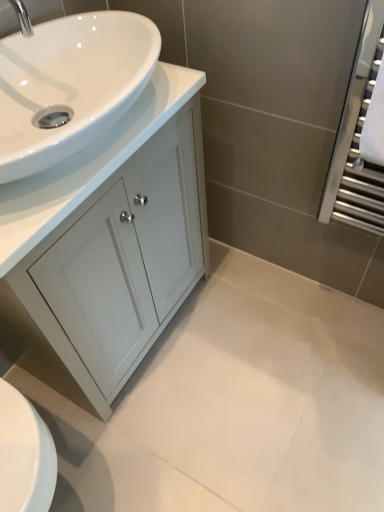
The height and width of the screenshot is (512, 384). What are the coordinates of `free space in front of white glossy cabinet at left` in the screenshot? It's located at (168, 432).